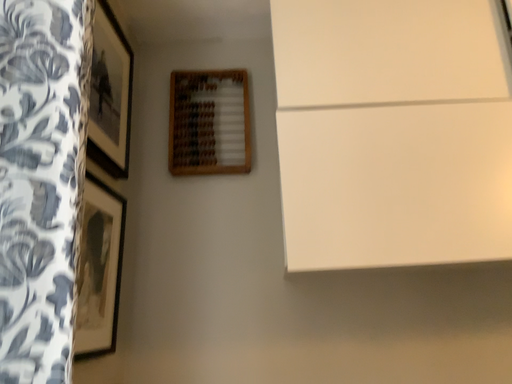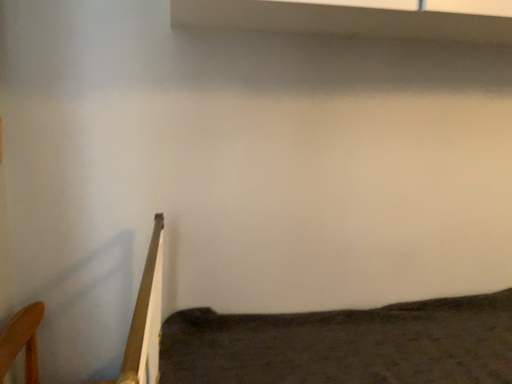
Question: How did the camera likely rotate when shooting the video?

Choices:
 (A) rotated left
 (B) rotated right

Answer: (B)